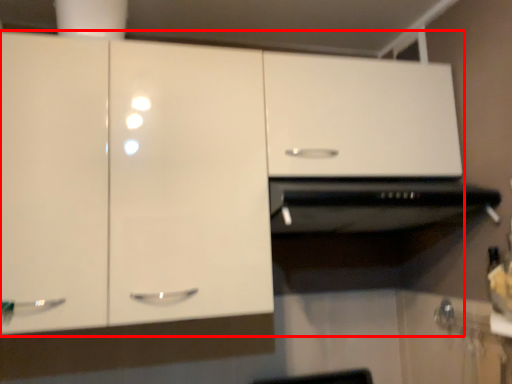
Question: Observing the image, what is the correct spatial positioning of cabinetry (annotated by the red box) in reference to vent?

Choices:
 (A) left
 (B) right

Answer: (A)